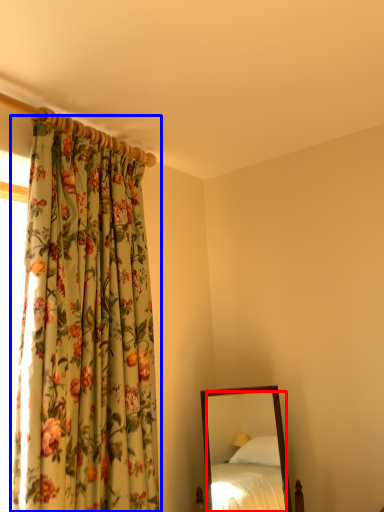
Question: Which object is further to the camera taking this photo, mirror (highlighted by a red box) or curtain (highlighted by a blue box)?

Choices:
 (A) mirror
 (B) curtain

Answer: (A)